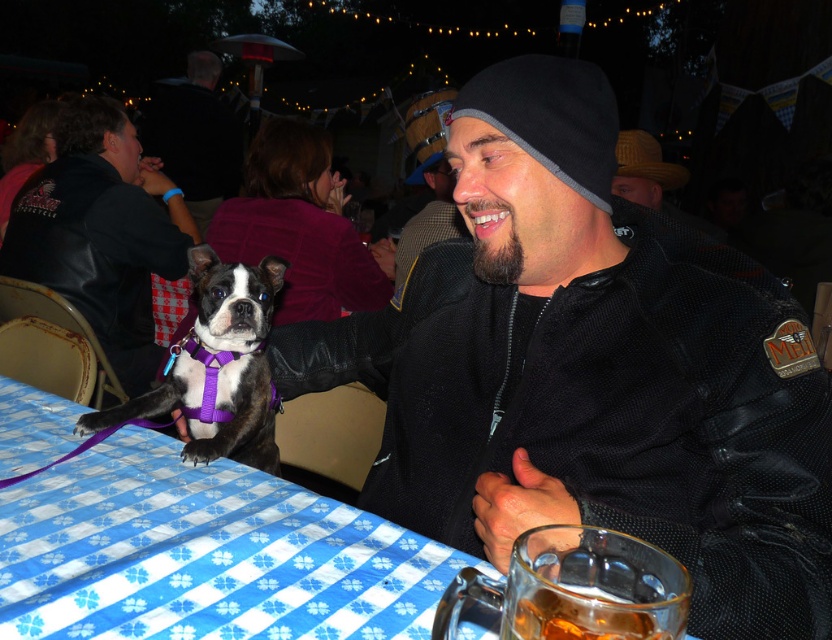
Question: Which of the following is the closest to the observer?

Choices:
 (A) pos(145,131)
 (B) pos(256,445)

Answer: (B)

Question: Which point is closer to the camera?

Choices:
 (A) black mesh jacket at center
 (B) black leather jacket at left
 (C) translucent glass mug at lower right

Answer: (C)

Question: Does black mesh jacket at center have a lesser width compared to translucent glass mug at lower right?

Choices:
 (A) yes
 (B) no

Answer: (B)

Question: Is blue checkered tablecloth at lower left further to the viewer compared to black and white fur at center?

Choices:
 (A) yes
 (B) no

Answer: (B)

Question: Can you confirm if blue checkered tablecloth at lower left is thinner than translucent glass mug at lower right?

Choices:
 (A) no
 (B) yes

Answer: (A)

Question: Which of the following is the closest to the observer?

Choices:
 (A) (23, 634)
 (B) (560, 310)

Answer: (A)